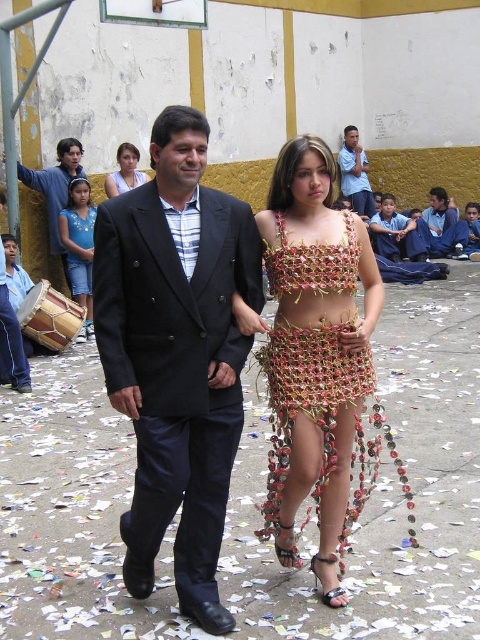
You are an artist setting up an outdoor exhibition in the schoolyard. You have two items to place on display next to each other. The blue fabric drum at left and the light blue fabric at upper left. According to the scene description, which of these two items is positioned further to the left?

The blue fabric drum at left is positioned further to the left compared to the light blue fabric at upper left, as it is stated to be to the left of the latter.

You are a photographer positioned at the front of the scene. You want to capture a clear photo of the metallic woven dress at center and the matte black suit at center. Which one will appear larger in your photo?

The metallic woven dress at center will appear larger in the photo because it is closer to the viewer than the matte black suit at center.

You are a photographer trying to capture a clear shot of both the matte black suit at center and the blue striped shirt at upper center. Since the camera can only focus on objects of a certain height, which one should you prioritize to ensure it is in focus?

The blue striped shirt at upper center should be prioritized because it is taller than the matte black suit at center, so focusing on it would ensure it is in focus.